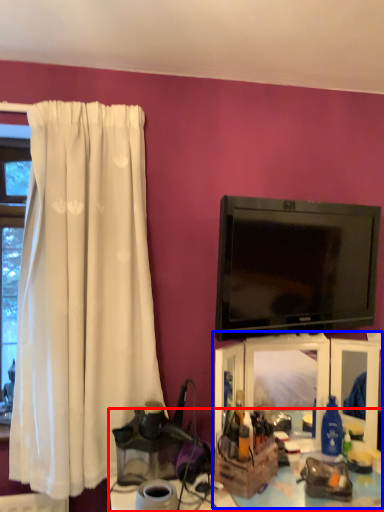
Question: Among these objects, which one is farthest to the camera, table (highlighted by a red box) or entertainment center (highlighted by a blue box)?

Choices:
 (A) table
 (B) entertainment center

Answer: (B)